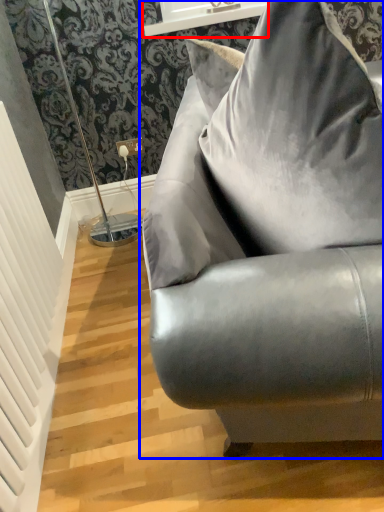
Question: Which of the following is the closest to the observer, window sill (highlighted by a red box) or studio couch (highlighted by a blue box)?

Choices:
 (A) window sill
 (B) studio couch

Answer: (B)